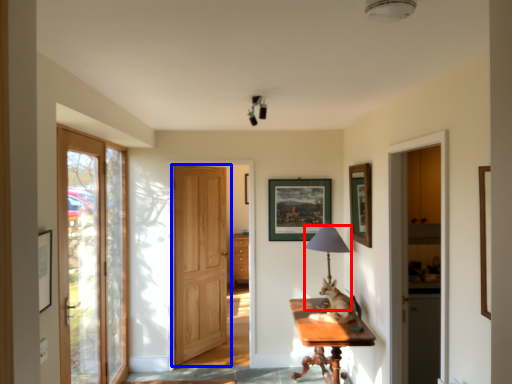
Question: Among these objects, which one is farthest to the camera, table lamp (highlighted by a red box) or door (highlighted by a blue box)?

Choices:
 (A) table lamp
 (B) door

Answer: (B)